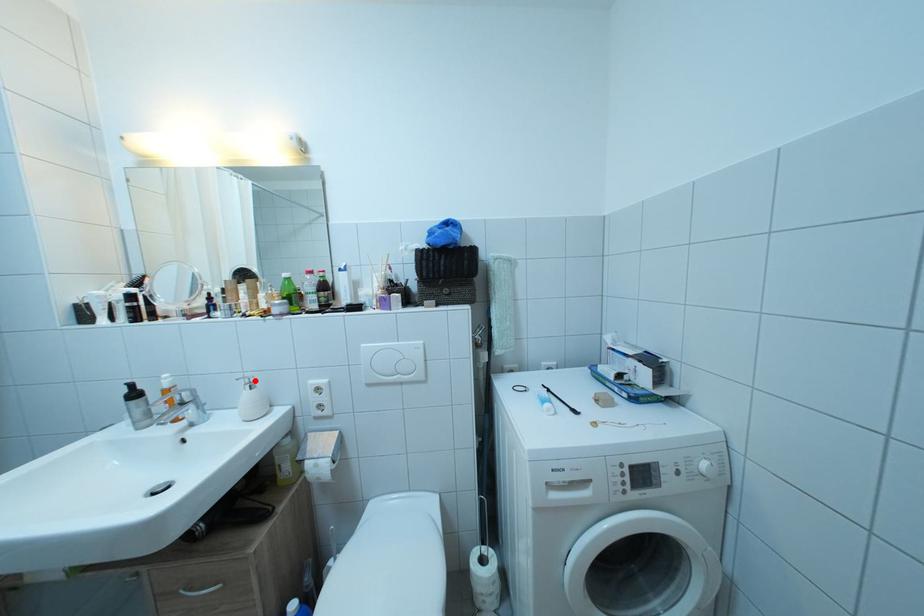
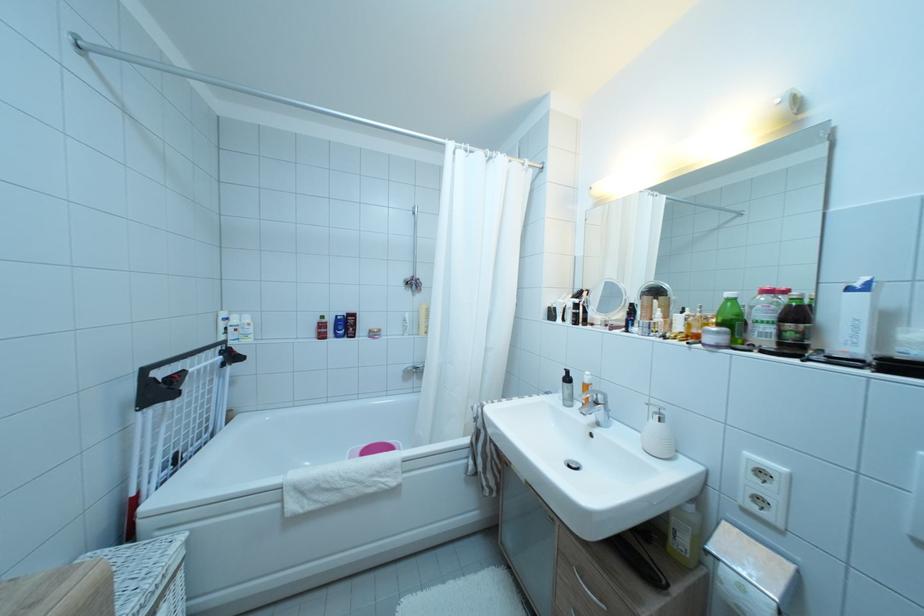
In the second image, find the point that corresponds to the highlighted location in the first image.

(661, 407)